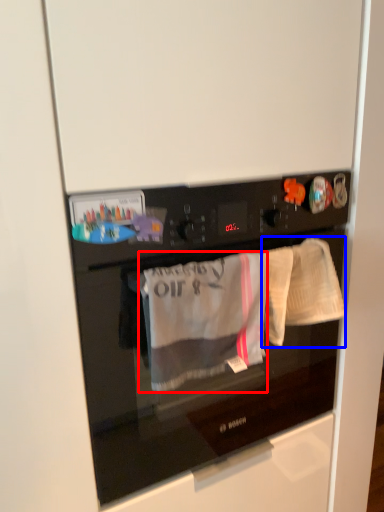
Question: Among these objects, which one is nearest to the camera, clothing (highlighted by a red box) or baby clothe (highlighted by a blue box)?

Choices:
 (A) clothing
 (B) baby clothe

Answer: (A)